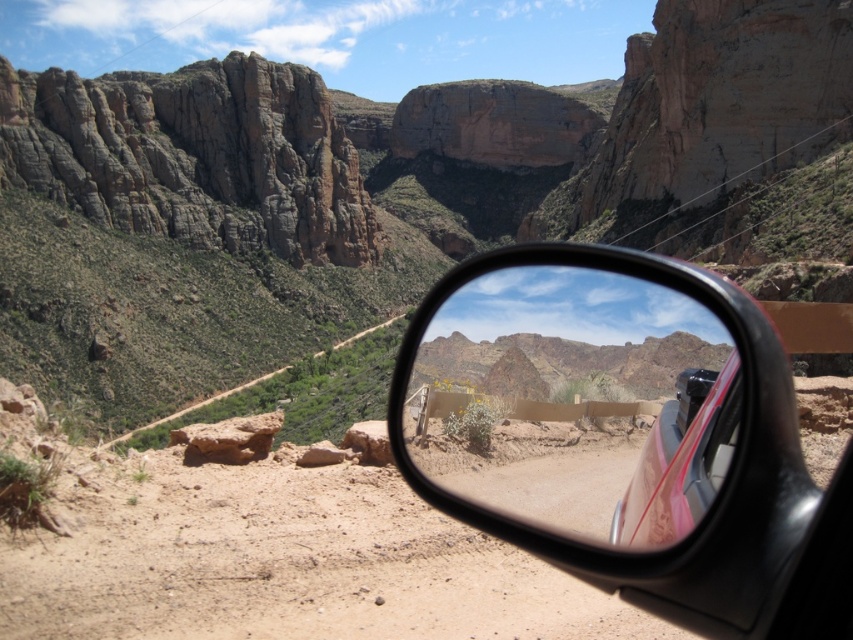
Is metallic car side mirror at center taller than pink glossy car at right?

Yes, metallic car side mirror at center is taller than pink glossy car at right.

Which is below, metallic car side mirror at center or pink glossy car at right?

pink glossy car at right

Who is more forward, (674, 324) or (651, 493)?

Point (651, 493) is more forward.

Locate an element on the screen. The height and width of the screenshot is (640, 853). metallic car side mirror at center is located at coordinates (576, 403).

Can you confirm if brown sandy dirt track at lower center is smaller than metallic car side mirror at center?

Indeed, brown sandy dirt track at lower center has a smaller size compared to metallic car side mirror at center.

Is point (76, 538) positioned behind point (524, 365)?

That is False.

The image size is (853, 640). Describe the element at coordinates (281, 563) in the screenshot. I see `brown sandy dirt track at lower center` at that location.

Where is `brown sandy dirt track at lower center`? This screenshot has width=853, height=640. brown sandy dirt track at lower center is located at coordinates (281, 563).

Is brown sandy dirt track at lower center further to camera compared to clear glass window at center?

No, brown sandy dirt track at lower center is in front of clear glass window at center.

Does brown sandy dirt track at lower center lie in front of clear glass window at center?

Yes, it is in front of clear glass window at center.

Identify the location of brown sandy dirt track at lower center. (281, 563).